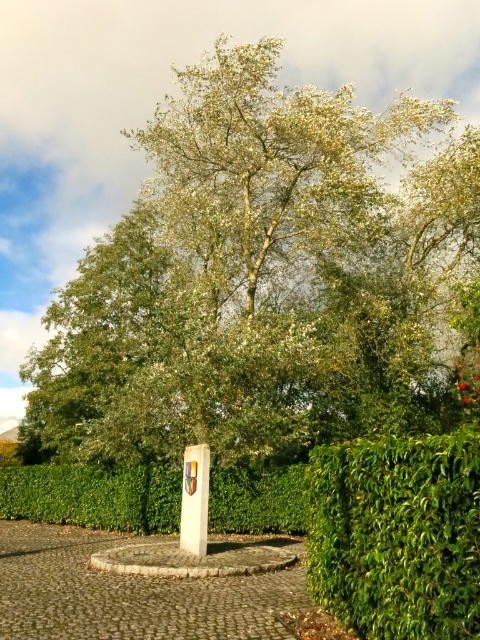
Which is more to the right, green leafy hedge at lower right or white stone sign at center?

green leafy hedge at lower right

Can you confirm if green leafy hedge at lower right is bigger than white stone sign at center?

Yes, green leafy hedge at lower right is bigger than white stone sign at center.

Is point (474, 438) closer to camera compared to point (191, 467)?

Yes, point (474, 438) is in front of point (191, 467).

Where is `green leafy hedge at lower right`? green leafy hedge at lower right is located at coordinates (396, 534).

Which of these two, green leafy hedge at center or white stone sign at center, stands shorter?

white stone sign at center

Is point (135, 529) positioned after point (196, 508)?

Yes, point (135, 529) is farther from viewer.

Where is `green leafy hedge at center`? Image resolution: width=480 pixels, height=640 pixels. green leafy hedge at center is located at coordinates (93, 497).

This screenshot has height=640, width=480. Describe the element at coordinates (264, 280) in the screenshot. I see `green leafy tree at center` at that location.

Who is shorter, green leafy tree at center or green leafy hedge at lower right?

With less height is green leafy hedge at lower right.

Measure the distance between green leafy tree at center and camera.

green leafy tree at center and camera are 50.96 feet apart.

I want to click on green leafy tree at center, so click(264, 280).